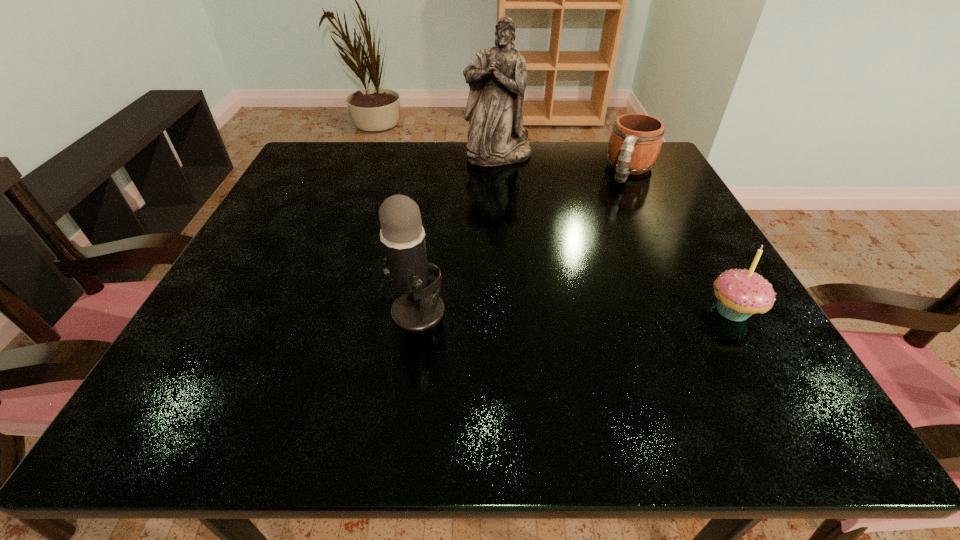
Locate an element on the screen. The height and width of the screenshot is (540, 960). vacant area that lies between the cupcake and the tallest object is located at coordinates (615, 233).

Where is `vacant area that lies between the figurine and the microphone`? vacant area that lies between the figurine and the microphone is located at coordinates (458, 234).

I want to click on empty location between the cupcake and the third object from right to left, so click(x=615, y=233).

Identify the location of blank region between the third shortest object and the mug. (524, 241).

In order to click on vacant area between the tallest object and the microphone in this screenshot , I will do `click(458, 234)`.

I want to click on free space between the cupcake and the leftmost object, so click(575, 312).

At what (x,y) coordinates should I click in order to perform the action: click on free space between the mug and the cupcake. Please return your answer as a coordinate pair (x, y). Looking at the image, I should click on (682, 241).

Locate an element on the screen. This screenshot has height=540, width=960. vacant space in between the figurine and the mug is located at coordinates (564, 163).

At what (x,y) coordinates should I click in order to perform the action: click on free space between the mug and the third shortest object. Please return your answer as a coordinate pair (x, y). This screenshot has width=960, height=540. Looking at the image, I should click on (524, 241).

Find the location of a particular element. the closest object relative to the tallest object is located at coordinates (636, 139).